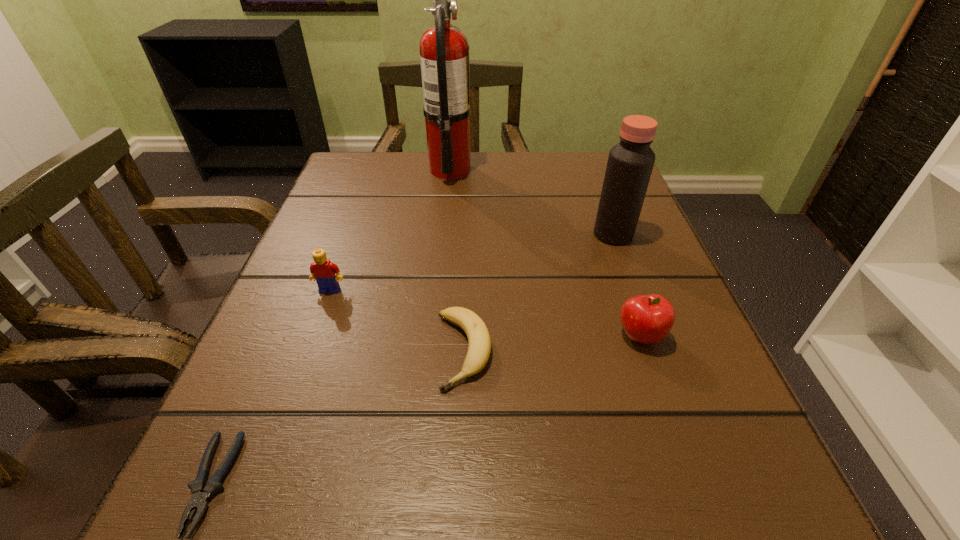
The width and height of the screenshot is (960, 540). In order to click on blank space located 0.090m on the face of the fourth nearest object in this screenshot , I will do tap(313, 336).

Image resolution: width=960 pixels, height=540 pixels. In order to click on blank area located on the front of the apple in this screenshot , I will do `click(679, 447)`.

Locate an element on the screen. This screenshot has height=540, width=960. vacant space positioned on the left of the banana is located at coordinates (291, 350).

Where is `object that is at the far edge`? The image size is (960, 540). object that is at the far edge is located at coordinates (444, 57).

Image resolution: width=960 pixels, height=540 pixels. Find the location of `object that is at the left edge`. object that is at the left edge is located at coordinates (322, 269).

The image size is (960, 540). Find the location of `vinegar that is positioned at the right edge`. vinegar that is positioned at the right edge is located at coordinates (630, 163).

Where is `apple that is positioned at the right edge`? This screenshot has height=540, width=960. apple that is positioned at the right edge is located at coordinates (647, 319).

Find the location of `free location at the far edge`. free location at the far edge is located at coordinates (481, 152).

You are a GUI agent. You are given a task and a screenshot of the screen. Output one action in this format:
    pyautogui.click(x=<x>, y=<y>)
    Task: Click on the free location at the near edge of the desktop
    The image size is (960, 540).
    Given the screenshot: What is the action you would take?
    pyautogui.click(x=377, y=467)

In the image, there is a desktop. At what (x,y) coordinates should I click in order to perform the action: click on vacant space at the right edge. Please return your answer as a coordinate pair (x, y). Looking at the image, I should click on (608, 365).